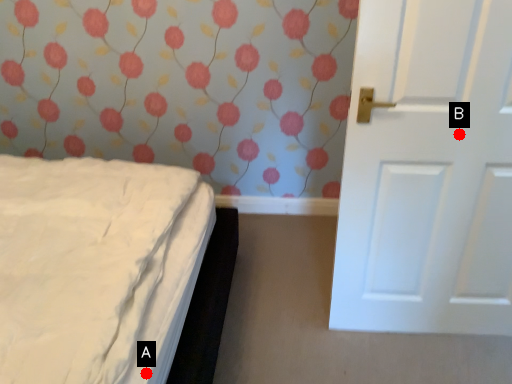
Question: Two points are circled on the image, labeled by A and B beside each circle. Which point is closer to the camera?

Choices:
 (A) A is closer
 (B) B is closer

Answer: (A)